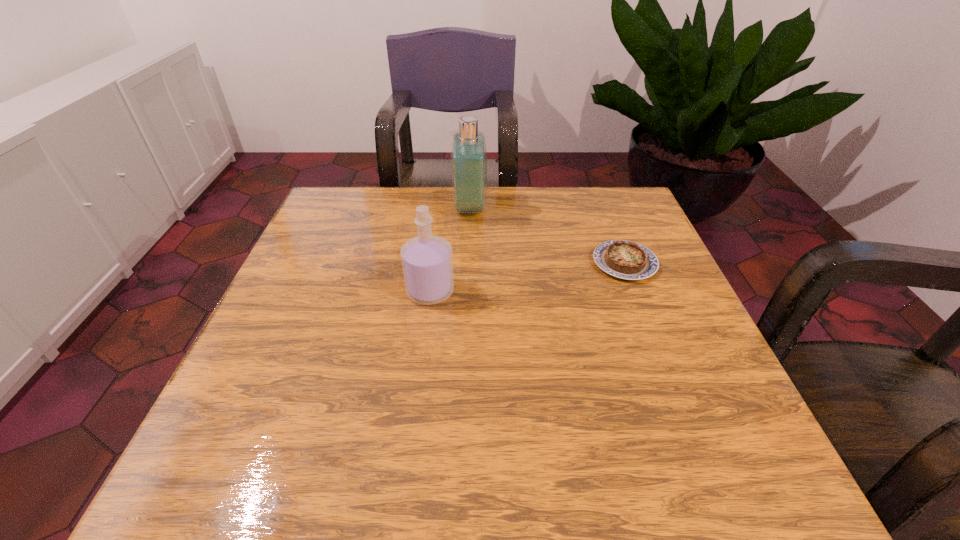
The width and height of the screenshot is (960, 540). Find the location of `vacant area that satisfies the following two spatial constraints: 1. on the front label of the farthest object; 2. on the back side of the quiche`. vacant area that satisfies the following two spatial constraints: 1. on the front label of the farthest object; 2. on the back side of the quiche is located at coordinates (468, 263).

Locate an element on the screen. vacant area that satisfies the following two spatial constraints: 1. on the front label of the farther perfume; 2. on the left side of the rightmost object is located at coordinates (468, 263).

You are a GUI agent. You are given a task and a screenshot of the screen. Output one action in this format:
    pyautogui.click(x=<x>, y=<y>)
    Task: Click on the free space that satisfies the following two spatial constraints: 1. on the front label of the farthest object; 2. on the back side of the shortest object
    
    Given the screenshot: What is the action you would take?
    pyautogui.click(x=468, y=263)

Where is `free space that satisfies the following two spatial constraints: 1. on the back side of the shortest object; 2. on the left side of the second shortest object`? The width and height of the screenshot is (960, 540). free space that satisfies the following two spatial constraints: 1. on the back side of the shortest object; 2. on the left side of the second shortest object is located at coordinates (434, 263).

Locate an element on the screen. vacant space that satisfies the following two spatial constraints: 1. on the front label of the farther perfume; 2. on the left side of the shortest object is located at coordinates (468, 263).

In order to click on free location that satisfies the following two spatial constraints: 1. on the front label of the farthest object; 2. on the right side of the rightmost object in this screenshot , I will do (468, 263).